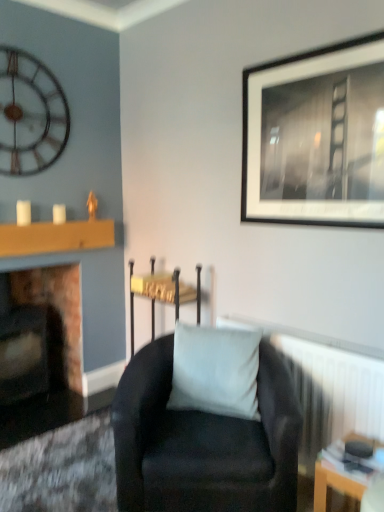
Question: Should I look upward or downward to see suede black armchair at center?

Choices:
 (A) up
 (B) down

Answer: (B)

Question: Considering the relative sizes of black matte picture frame at upper right and velvet black armchair at center in the image provided, is black matte picture frame at upper right wider than velvet black armchair at center?

Choices:
 (A) yes
 (B) no

Answer: (B)

Question: From a real-world perspective, is black matte picture frame at upper right over velvet black armchair at center?

Choices:
 (A) no
 (B) yes

Answer: (B)

Question: From a real-world perspective, is black matte picture frame at upper right located beneath velvet black armchair at center?

Choices:
 (A) yes
 (B) no

Answer: (B)

Question: Could you tell me if black matte picture frame at upper right is facing velvet black armchair at center?

Choices:
 (A) yes
 (B) no

Answer: (B)

Question: From the image's perspective, does black matte picture frame at upper right appear higher than velvet black armchair at center?

Choices:
 (A) yes
 (B) no

Answer: (A)

Question: Is black matte picture frame at upper right to the left of velvet black armchair at center from the viewer's perspective?

Choices:
 (A) no
 (B) yes

Answer: (A)

Question: Is metallic wall clock at upper left behind suede black armchair at center?

Choices:
 (A) no
 (B) yes

Answer: (B)

Question: Is metallic wall clock at upper left far away from suede black armchair at center?

Choices:
 (A) yes
 (B) no

Answer: (A)

Question: Considering the relative sizes of metallic wall clock at upper left and suede black armchair at center in the image provided, is metallic wall clock at upper left wider than suede black armchair at center?

Choices:
 (A) no
 (B) yes

Answer: (A)

Question: Does metallic wall clock at upper left have a lesser width compared to suede black armchair at center?

Choices:
 (A) yes
 (B) no

Answer: (A)

Question: Can you confirm if metallic wall clock at upper left is positioned to the left of suede black armchair at center?

Choices:
 (A) no
 (B) yes

Answer: (B)

Question: Does metallic wall clock at upper left appear on the right side of suede black armchair at center?

Choices:
 (A) yes
 (B) no

Answer: (B)

Question: Is white matte pillow at center oriented towards metallic wall clock at upper left?

Choices:
 (A) yes
 (B) no

Answer: (B)